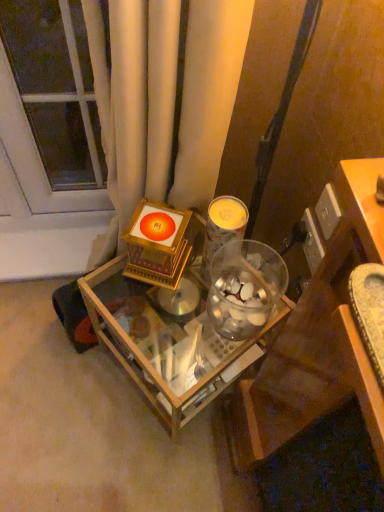
Question: Is metallic silver candle at center taller or shorter than transparent glass door at upper left?

Choices:
 (A) tall
 (B) short

Answer: (B)

Question: From the image's perspective, is metallic silver candle at center positioned above or below transparent glass door at upper left?

Choices:
 (A) above
 (B) below

Answer: (B)

Question: Which of these objects is positioned farthest from the metallic silver candle at center?

Choices:
 (A) wooden table at center
 (B) transparent glass door at upper left

Answer: (B)

Question: Which object is the farthest from the transparent glass door at upper left?

Choices:
 (A) metallic silver candle at center
 (B) wooden table at center

Answer: (B)